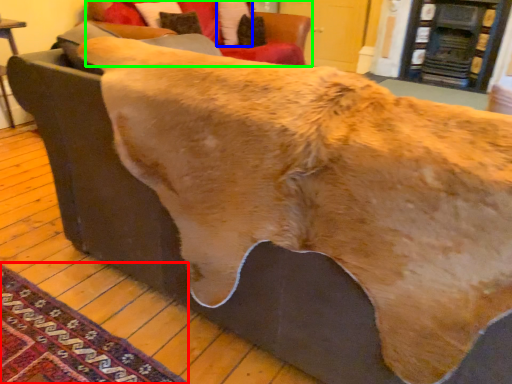
Question: Which is farther away from mat (highlighted by a red box)? pillow (highlighted by a blue box) or studio couch (highlighted by a green box)?

Choices:
 (A) pillow
 (B) studio couch

Answer: (A)